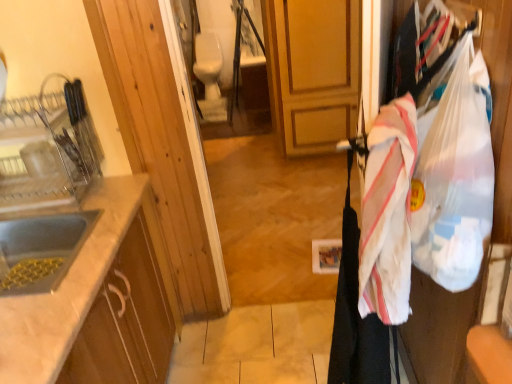
Question: Is matte silver sink at left, which is counted as the 1th sink, starting from the top, taller than white marble countertop at left?

Choices:
 (A) yes
 (B) no

Answer: (B)

Question: Is white marble countertop at left a part of matte silver sink at left, the 2th sink in the bottom-to-top sequence?

Choices:
 (A) yes
 (B) no

Answer: (B)

Question: From a real-world perspective, is matte silver sink at left, which is counted as the 1th sink, starting from the top, physically below white marble countertop at left?

Choices:
 (A) yes
 (B) no

Answer: (B)

Question: Is matte silver sink at left, which is counted as the 1th sink, starting from the top, further to the viewer compared to white marble countertop at left?

Choices:
 (A) no
 (B) yes

Answer: (B)

Question: Considering the relative sizes of matte silver sink at left, which is counted as the 1th sink, starting from the top, and white marble countertop at left in the image provided, is matte silver sink at left, which is counted as the 1th sink, starting from the top, bigger than white marble countertop at left?

Choices:
 (A) no
 (B) yes

Answer: (A)

Question: Considering the relative sizes of matte silver sink at left, which is counted as the 1th sink, starting from the top, and white marble countertop at left in the image provided, is matte silver sink at left, which is counted as the 1th sink, starting from the top, wider than white marble countertop at left?

Choices:
 (A) yes
 (B) no

Answer: (B)

Question: Does white marble countertop at left appear on the right side of matte silver sink at left, the 2th sink in the bottom-to-top sequence?

Choices:
 (A) yes
 (B) no

Answer: (A)

Question: From the image's perspective, is white marble countertop at left on matte silver sink at left, which is counted as the 1th sink, starting from the top?

Choices:
 (A) yes
 (B) no

Answer: (B)

Question: Can you confirm if white marble countertop at left is shorter than matte silver sink at left, the 2th sink in the bottom-to-top sequence?

Choices:
 (A) no
 (B) yes

Answer: (A)

Question: Is matte silver sink at left, which is counted as the 1th sink, starting from the top, surrounded by white marble countertop at left?

Choices:
 (A) yes
 (B) no

Answer: (B)

Question: Considering the relative sizes of white marble countertop at left and matte silver sink at left, the 2th sink in the bottom-to-top sequence, in the image provided, is white marble countertop at left wider than matte silver sink at left, the 2th sink in the bottom-to-top sequence,?

Choices:
 (A) yes
 (B) no

Answer: (A)

Question: Is white marble countertop at left thinner than matte silver sink at left, which is counted as the 1th sink, starting from the top?

Choices:
 (A) yes
 (B) no

Answer: (B)

Question: Is white marble countertop at left taller than translucent plastic grocery bag at right?

Choices:
 (A) no
 (B) yes

Answer: (B)